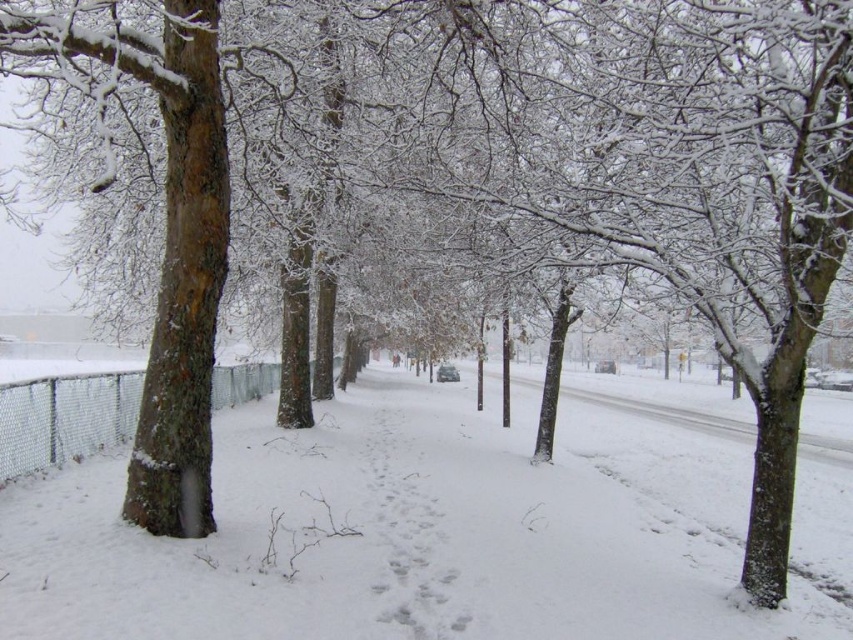
Question: Is white snow pavement at center wider than metal mesh fence at left?

Choices:
 (A) no
 (B) yes

Answer: (B)

Question: Which of the following is the closest to the observer?

Choices:
 (A) metal mesh fence at left
 (B) white snow pavement at center

Answer: (B)

Question: Does white snow pavement at center appear on the right side of metal mesh fence at left?

Choices:
 (A) yes
 (B) no

Answer: (A)

Question: Which point is closer to the camera taking this photo?

Choices:
 (A) (347, 618)
 (B) (18, 381)

Answer: (A)

Question: Observing the image, what is the correct spatial positioning of white snow pavement at center in reference to metal mesh fence at left?

Choices:
 (A) right
 (B) left

Answer: (A)